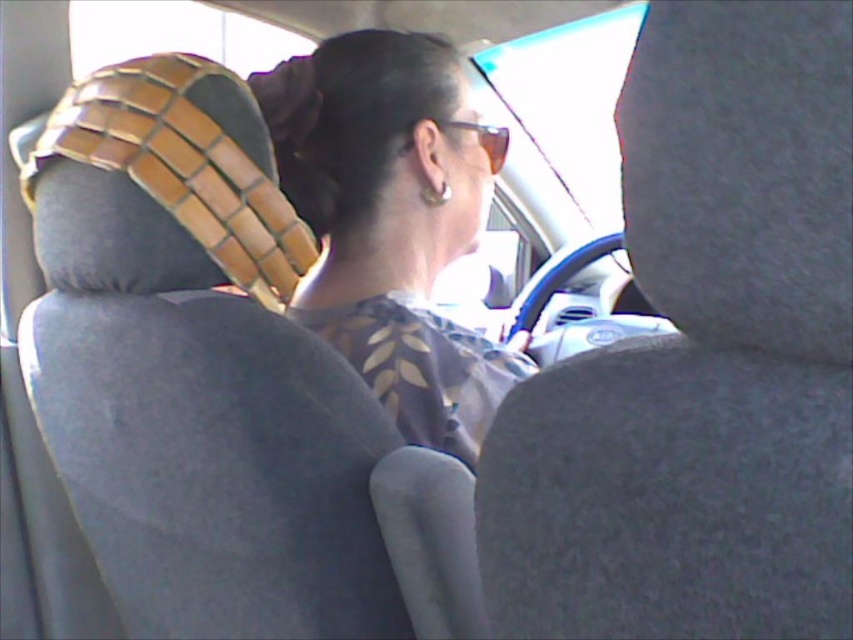
Who is more forward, (699,212) or (440,49)?

Point (699,212)

Between gray fabric seat at center and matte gray shirt at center, which one is positioned higher?

matte gray shirt at center

Where is `gray fabric seat at center`? This screenshot has width=853, height=640. gray fabric seat at center is located at coordinates (700, 358).

Image resolution: width=853 pixels, height=640 pixels. I want to click on gray fabric seat at center, so click(700, 358).

Image resolution: width=853 pixels, height=640 pixels. What are the coordinates of `gray fabric seat at center` in the screenshot? It's located at (700, 358).

Locate an element on the screen. The image size is (853, 640). gray fabric seat at center is located at coordinates (700, 358).

Measure the distance from matte gray shirt at center to black woven hair at upper center.

matte gray shirt at center and black woven hair at upper center are 5.35 inches apart.

Does matte gray shirt at center appear on the left side of black woven hair at upper center?

No, matte gray shirt at center is not to the left of black woven hair at upper center.

Where is `matte gray shirt at center`? matte gray shirt at center is located at coordinates (390, 224).

Identify the location of matte gray shirt at center. (390, 224).